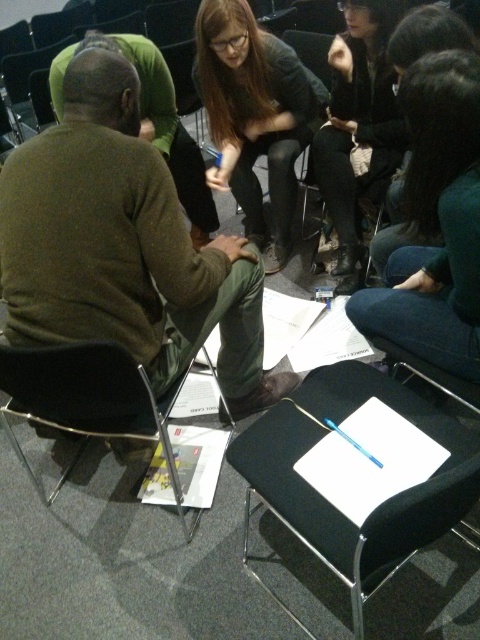
Question: Where is matte brown sweater at left located in relation to dark brown sweater at center in the image?

Choices:
 (A) below
 (B) above

Answer: (A)

Question: Which object appears farthest from the camera in this image?

Choices:
 (A) matte gray sweater at center
 (B) black leather jacket at upper center

Answer: (A)

Question: Considering the real-world distances, which object is closest to the black leather jacket at upper center?

Choices:
 (A) matte gray sweater at center
 (B) black fabric folding chair at lower center
 (C) dark brown sweater at center

Answer: (A)

Question: Which point appears closest to the camera in this image?

Choices:
 (A) (111, 282)
 (B) (276, 600)
 (C) (229, 157)

Answer: (A)

Question: Is matte brown sweater at left smaller than dark brown sweater at center?

Choices:
 (A) yes
 (B) no

Answer: (B)

Question: Observing the image, what is the correct spatial positioning of matte brown sweater at left in reference to matte gray sweater at center?

Choices:
 (A) above
 (B) below

Answer: (B)